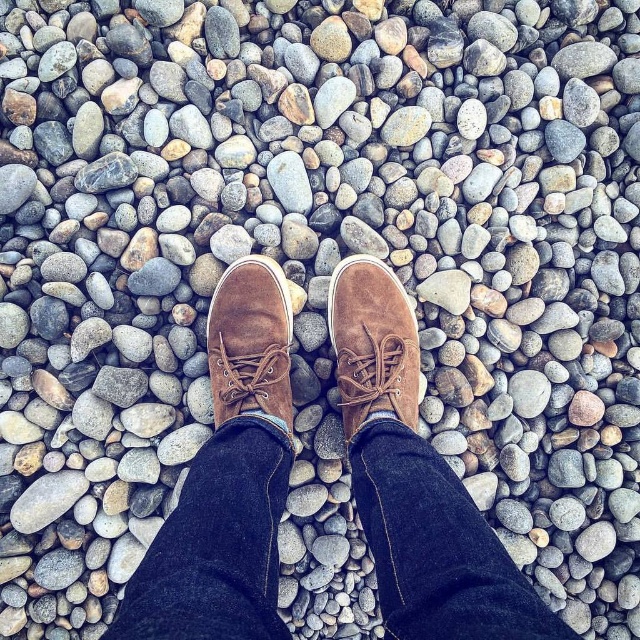
You are a photographer trying to capture the texture of the denim at center and the suede brown shoe at center. Since the denim is under the shoe, will the shoe block the denim from view?

The denim at center is positioned under the suede brown shoe at center, so the shoe will block the denim from view.

You are examining the image of the feet on the pebbles. Which of the two points, point (230, 550) or point (220, 412), is located closer to your viewpoint?

Point (230, 550) is closer to the viewer than point (220, 412).

You are standing in a garden with two footwear items in front of you. You see a suede brown shoe at center and a suede brown boot at center. Which footwear item is positioned to the right of the other?

The suede brown shoe at center is to the right of the suede brown boot at center.